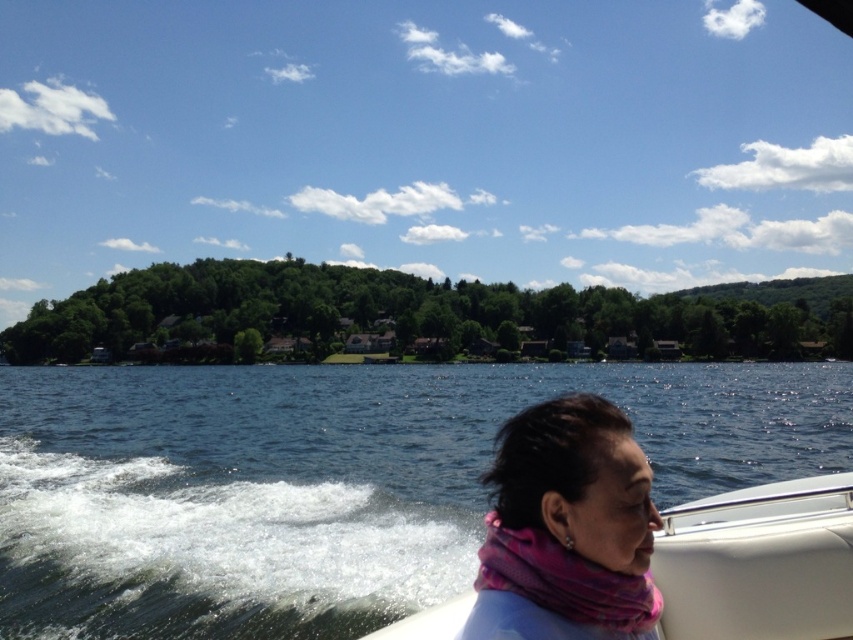
Does pink fabric scarf at lower right have a greater width compared to white matte boat at center?

No.

Who is more forward, (641, 618) or (822, 518)?

Positioned in front is point (641, 618).

Where is `pink fabric scarf at lower right`? The width and height of the screenshot is (853, 640). pink fabric scarf at lower right is located at coordinates (567, 529).

How much distance is there between blue water at lower left and white matte boat at center?

48.20 meters

What are the coordinates of `blue water at lower left` in the screenshot? It's located at (329, 483).

This screenshot has width=853, height=640. I want to click on blue water at lower left, so click(329, 483).

Is blue water at lower left taller than pink fabric scarf at lower right?

Yes.

Which is behind, point (293, 566) or point (550, 620)?

Positioned behind is point (293, 566).

Identify the location of blue water at lower left. [329, 483].